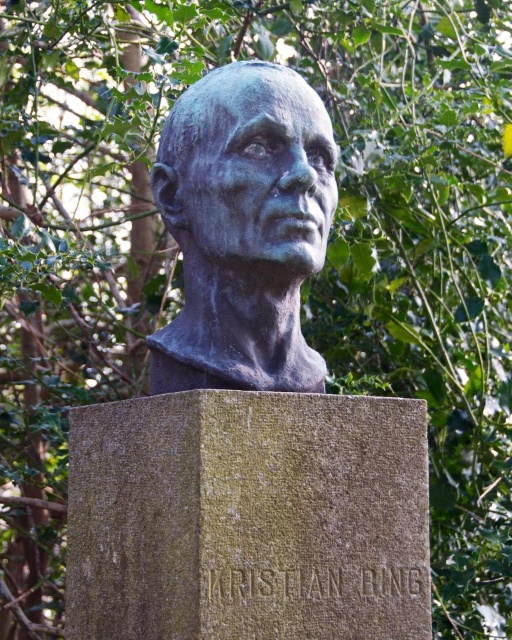
Who is lower down, green stone gravestone at center or bronze bust at center?

green stone gravestone at center

Describe the element at coordinates (247, 516) in the screenshot. The height and width of the screenshot is (640, 512). I see `green stone gravestone at center` at that location.

Between point (81, 576) and point (259, 272), which one is positioned behind?

Point (81, 576)

I want to click on green stone gravestone at center, so [247, 516].